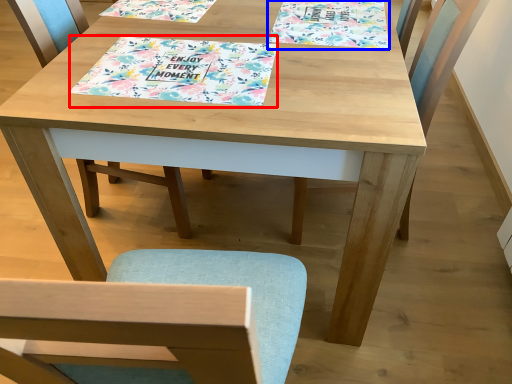
Question: Which object is further to the camera taking this photo, tablecloth (highlighted by a red box) or book cover (highlighted by a blue box)?

Choices:
 (A) tablecloth
 (B) book cover

Answer: (B)